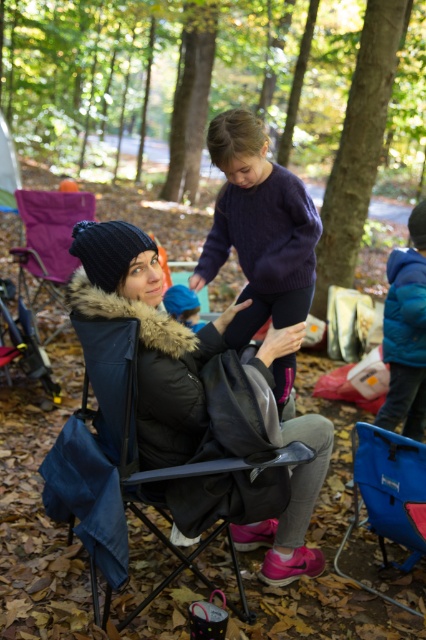
You are an architect designing a new outdoor seating area and want to place a bench where the purple knitted sweater at upper center is located. The coordinates given are in a normalized system where 0.0 is the bottom left corner and 1.0 is the top right corner. What are the coordinates of the bench location?

The coordinates of the bench location should be set at point 0.358 on the x axis and 0.608 on the y axis, as specified by the position of the purple knitted sweater at upper center.

You are a photographer trying to capture the black fuzzy jacket at center in your shot. Based on its position in the scene, where should you aim your camera to ensure it is centered in the frame?

To center the black fuzzy jacket at center in your shot, aim your camera at the coordinates point (149, 337), which is its 2D location in the scene.

You are a photographer capturing the scene described. You notice the purple knitted sweater at upper center and the blue fabric folding chair at lower right. Which object is located to the left of the other?

The purple knitted sweater at upper center is positioned on the left side of blue fabric folding chair at lower right.